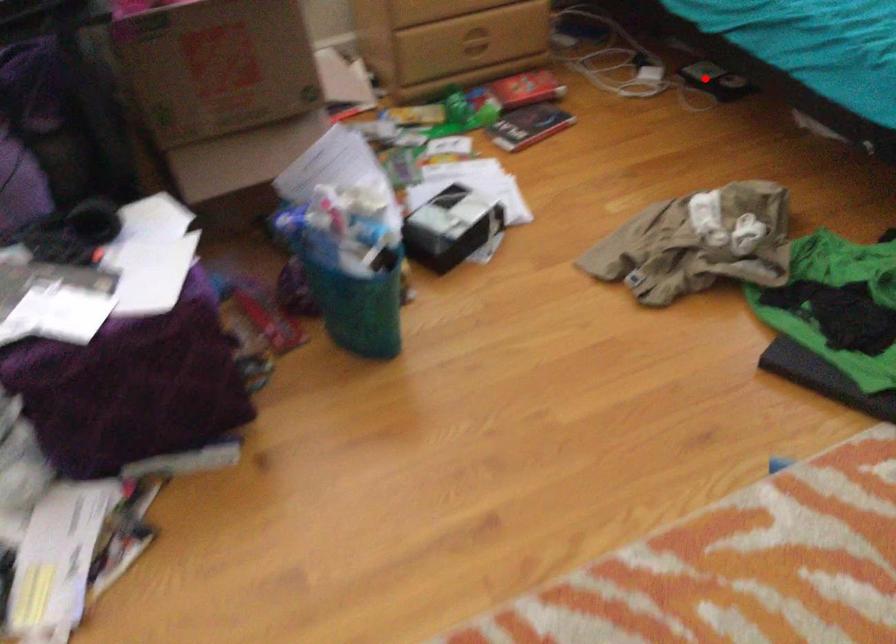
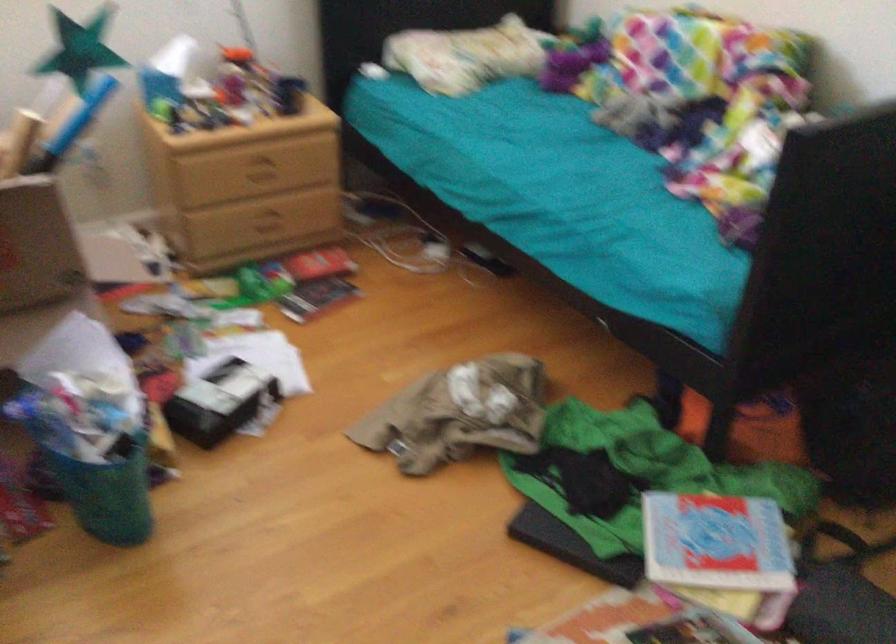
The point at the highlighted location is marked in the first image. Where is the corresponding point in the second image?

(481, 259)